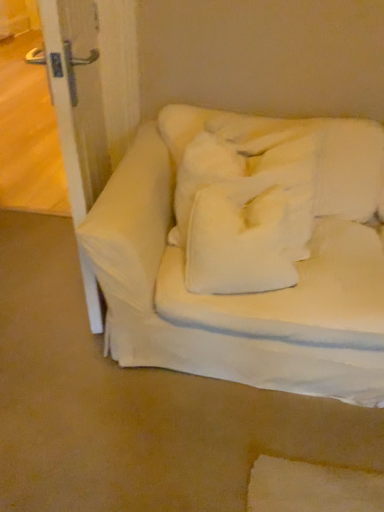
Question: Is white fabric couch at center not inside white soft pillow at center?

Choices:
 (A) no
 (B) yes

Answer: (B)

Question: From a real-world perspective, is white fabric couch at center on top of white soft pillow at center?

Choices:
 (A) no
 (B) yes

Answer: (A)

Question: Does white fabric couch at center come behind white soft pillow at center?

Choices:
 (A) no
 (B) yes

Answer: (A)

Question: From the image's perspective, is white fabric couch at center located beneath white soft pillow at center?

Choices:
 (A) yes
 (B) no

Answer: (B)

Question: Is white fabric couch at center facing towards white soft pillow at center?

Choices:
 (A) no
 (B) yes

Answer: (B)

Question: Looking at their shapes, would you say white soft pillow at center is wider or thinner than white soft pillow at center?

Choices:
 (A) thin
 (B) wide

Answer: (B)

Question: In the image, is white soft pillow at center positioned in front of or behind white soft pillow at center?

Choices:
 (A) behind
 (B) front

Answer: (A)

Question: In the image, is white soft pillow at center on the left side or the right side of white soft pillow at center?

Choices:
 (A) left
 (B) right

Answer: (B)

Question: Does point (180, 193) appear closer or farther from the camera than point (210, 268)?

Choices:
 (A) farther
 (B) closer

Answer: (A)

Question: Which is correct: white soft pillow at center is inside white soft pillow at center, or outside of it?

Choices:
 (A) outside
 (B) inside

Answer: (A)

Question: From a real-world perspective, is white soft pillow at center physically located above or below white soft pillow at center?

Choices:
 (A) above
 (B) below

Answer: (B)

Question: From their relative heights in the image, would you say white soft pillow at center is taller or shorter than white soft pillow at center?

Choices:
 (A) tall
 (B) short

Answer: (B)

Question: From the image's perspective, relative to white soft pillow at center, is white soft pillow at center above or below?

Choices:
 (A) above
 (B) below

Answer: (B)

Question: From the image's perspective, relative to white fabric couch at center, is white soft pillow at center above or below?

Choices:
 (A) above
 (B) below

Answer: (A)

Question: Is white soft pillow at center inside or outside of white fabric couch at center?

Choices:
 (A) outside
 (B) inside

Answer: (B)